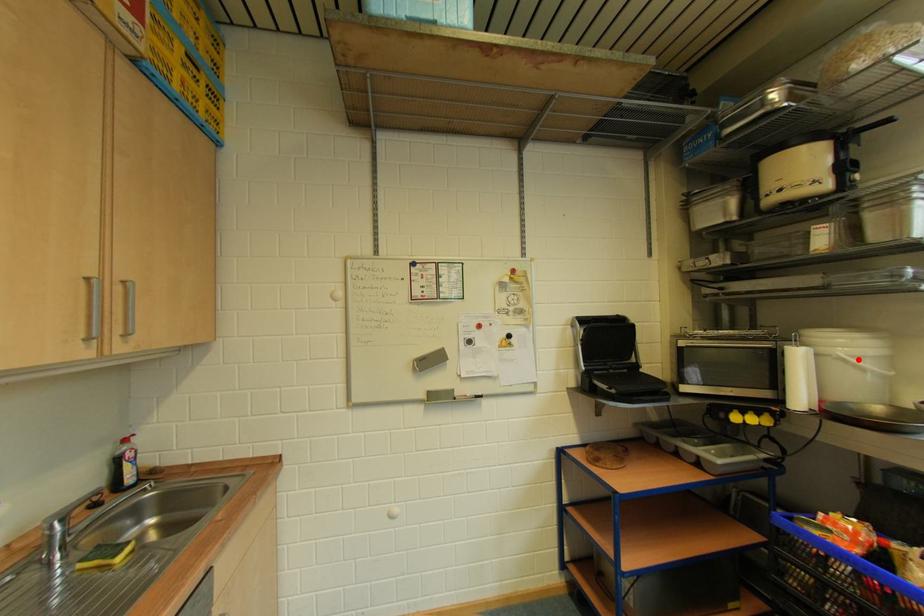
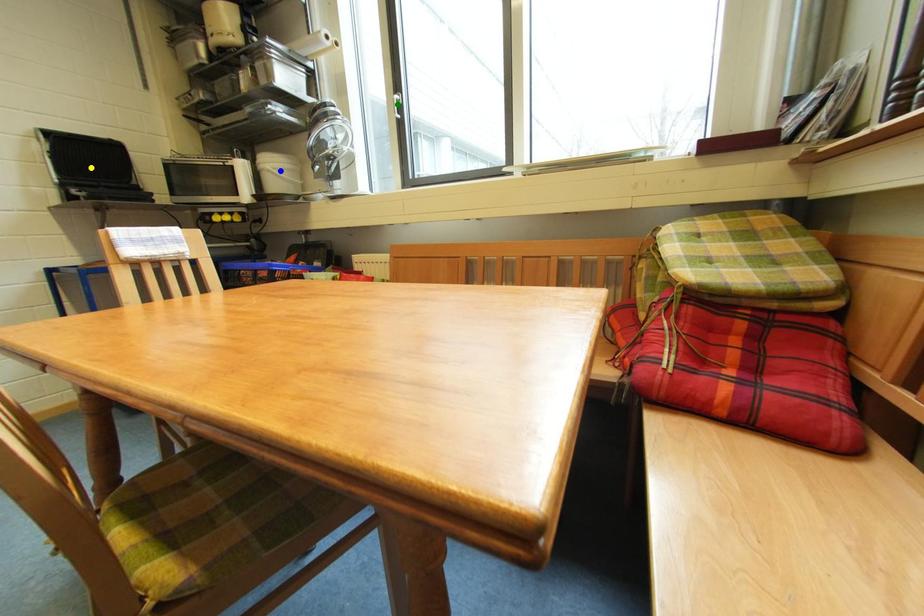
Question: I am providing you with two images of the same scene from different viewpoints. A red point is marked on the first image. You are given multiple points on the second image. In image 2, which mark is for the same physical point as the one in image 1?

Choices:
 (A) green point
 (B) yellow point
 (C) blue point

Answer: (C)